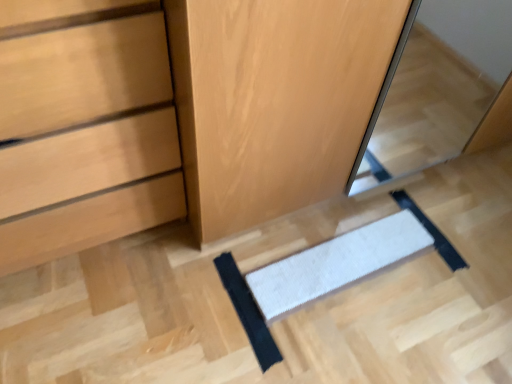
Question: Is white textured mat at center, the 1th doormat viewed from the left, behind wooden dresser at center?

Choices:
 (A) yes
 (B) no

Answer: (A)

Question: Can you confirm if white textured mat at center, the 1th doormat viewed from the left, is taller than wooden dresser at center?

Choices:
 (A) yes
 (B) no

Answer: (B)

Question: Can we say white textured mat at center, the 2th doormat viewed from the right, lies outside wooden dresser at center?

Choices:
 (A) yes
 (B) no

Answer: (A)

Question: Is white textured mat at center, the 2th doormat viewed from the right, looking in the opposite direction of wooden dresser at center?

Choices:
 (A) no
 (B) yes

Answer: (B)

Question: From a real-world perspective, does white textured mat at center, the 2th doormat viewed from the right, stand above wooden dresser at center?

Choices:
 (A) no
 (B) yes

Answer: (A)

Question: Visually, is white textured mat at center, the 1th doormat viewed from the left, positioned to the left or to the right of white textured mat at center, placed as the second doormat when sorted from left to right?

Choices:
 (A) left
 (B) right

Answer: (A)

Question: Is point (241, 317) closer or farther from the camera than point (360, 264)?

Choices:
 (A) farther
 (B) closer

Answer: (B)

Question: From the image's perspective, relative to white textured mat at center, placed as the 1th doormat when sorted from right to left, is white textured mat at center, the 2th doormat viewed from the right, above or below?

Choices:
 (A) below
 (B) above

Answer: (A)

Question: Looking at their shapes, would you say white textured mat at center, the 1th doormat viewed from the left, is wider or thinner than white textured mat at center, placed as the 1th doormat when sorted from right to left?

Choices:
 (A) wide
 (B) thin

Answer: (A)

Question: Do you think white textured mat at center, placed as the 1th doormat when sorted from right to left, is within matte wood chest of drawers at lower left, or outside of it?

Choices:
 (A) inside
 (B) outside

Answer: (B)

Question: Does point (294, 259) appear closer or farther from the camera than point (93, 183)?

Choices:
 (A) closer
 (B) farther

Answer: (B)

Question: Is white textured mat at center, placed as the second doormat when sorted from left to right, to the left or to the right of matte wood chest of drawers at lower left in the image?

Choices:
 (A) right
 (B) left

Answer: (A)

Question: From a real-world perspective, is white textured mat at center, placed as the 1th doormat when sorted from right to left, positioned above or below matte wood chest of drawers at lower left?

Choices:
 (A) below
 (B) above

Answer: (A)

Question: Is point (117, 41) closer or farther from the camera than point (251, 306)?

Choices:
 (A) farther
 (B) closer

Answer: (B)

Question: From a real-world perspective, is matte wood chest of drawers at lower left above or below white textured mat at center, the 2th doormat viewed from the right?

Choices:
 (A) above
 (B) below

Answer: (A)